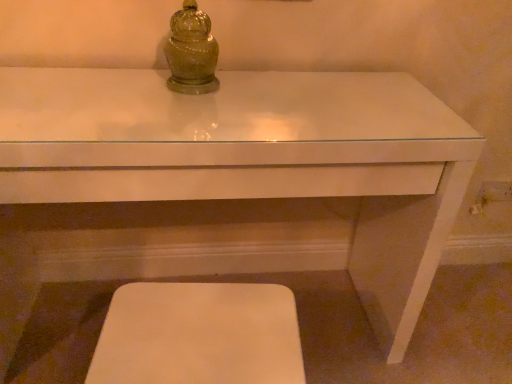
Image resolution: width=512 pixels, height=384 pixels. I want to click on free location to the right of green glass jar at upper center, so click(258, 89).